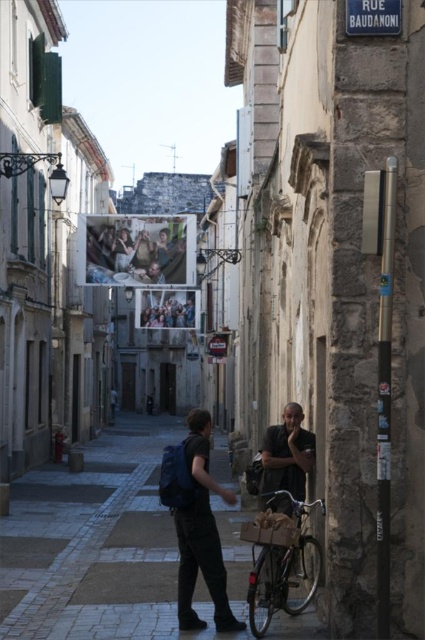
Is matte blue backpack at center thinner than matte plastic poster at center?

Correct, matte blue backpack at center's width is less than matte plastic poster at center's.

Is matte blue backpack at center to the left of matte plastic poster at center from the viewer's perspective?

No, matte blue backpack at center is not to the left of matte plastic poster at center.

Find the location of a particular element. The width and height of the screenshot is (425, 640). matte blue backpack at center is located at coordinates (197, 524).

I want to click on matte blue backpack at center, so click(197, 524).

Is point (268, 596) in front of point (291, 419)?

That is True.

Is metallic silver bicycle at lower right positioned in front of dark gray fabric jacket at center?

Yes, it is.

At what (x,y) coordinates should I click in order to perform the action: click on metallic silver bicycle at lower right. Please return your answer as a coordinate pair (x, y). Looking at the image, I should click on (282, 564).

Which is behind, point (189, 618) or point (317, 499)?

The point (317, 499) is more distant.

This screenshot has height=640, width=425. What do you see at coordinates (197, 524) in the screenshot?
I see `matte blue backpack at center` at bounding box center [197, 524].

Locate an element on the screen. matte blue backpack at center is located at coordinates (197, 524).